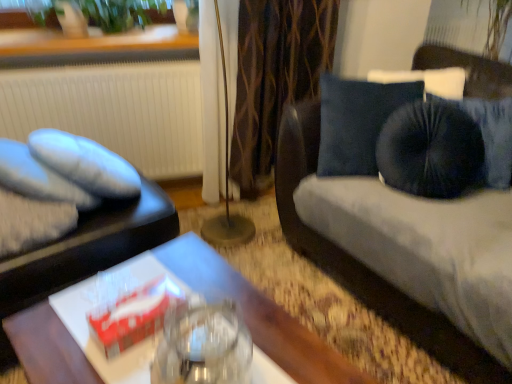
Question: From the image's perspective, is metallic gold floor lamp at center positioned above or below wooden table at center?

Choices:
 (A) above
 (B) below

Answer: (A)

Question: Does point (224, 233) appear closer or farther from the camera than point (212, 266)?

Choices:
 (A) farther
 (B) closer

Answer: (A)

Question: Estimate the real-world distances between objects in this image. Which object is closer to the soft gray fabric pillow at left?

Choices:
 (A) metallic gold floor lamp at center
 (B) green leafy plant at upper left
 (C) matte black tray at left
 (D) wooden table at center
 (E) brown textured curtain at center

Answer: (C)

Question: Estimate the real-world distances between objects in this image. Which object is closer to the wooden table at center?

Choices:
 (A) metallic gold floor lamp at center
 (B) velvet blue studio couch at right
 (C) white textured radiator at left
 (D) brown textured curtain at center
 (E) green leafy plant at upper left

Answer: (B)